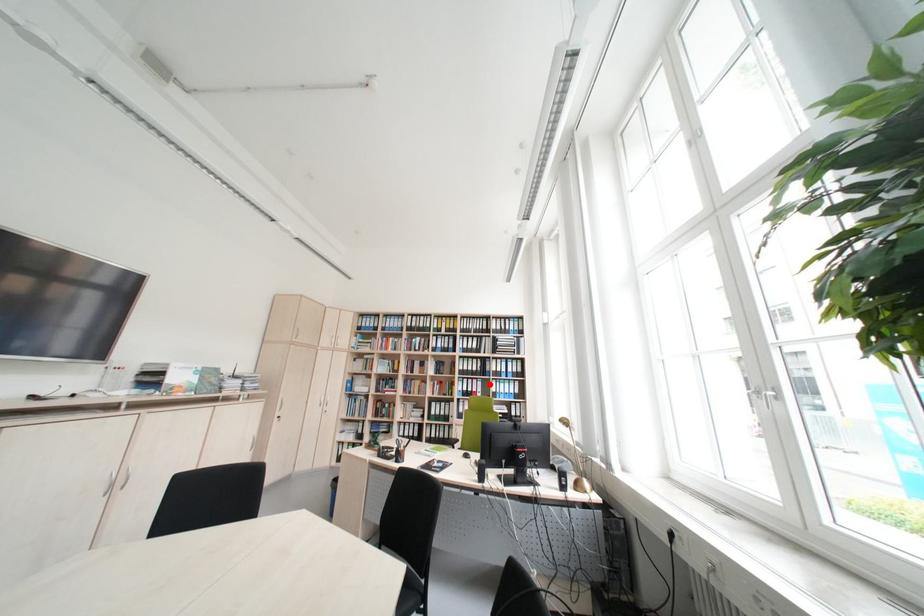
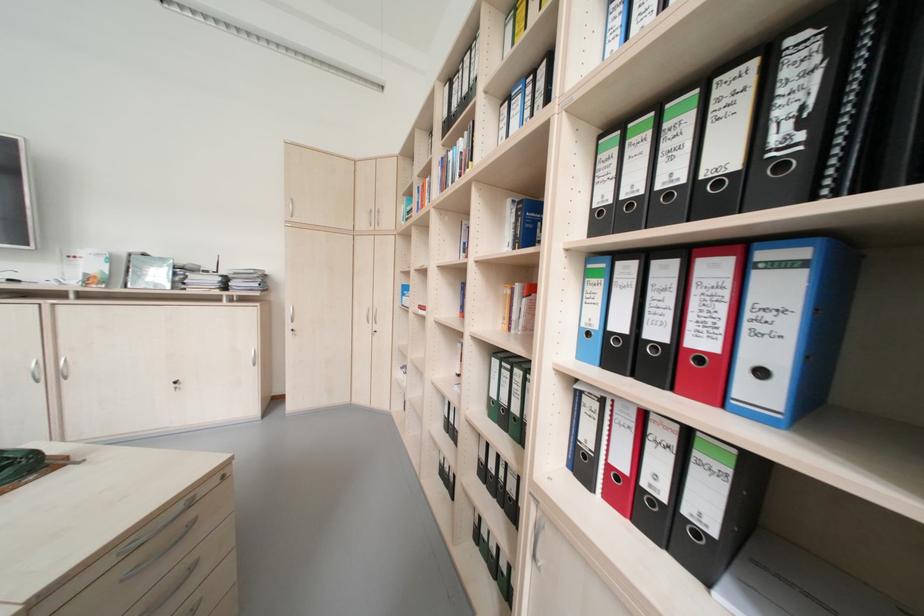
The point at the highlighted location is marked in the first image. Where is the corresponding point in the second image?

(793, 290)